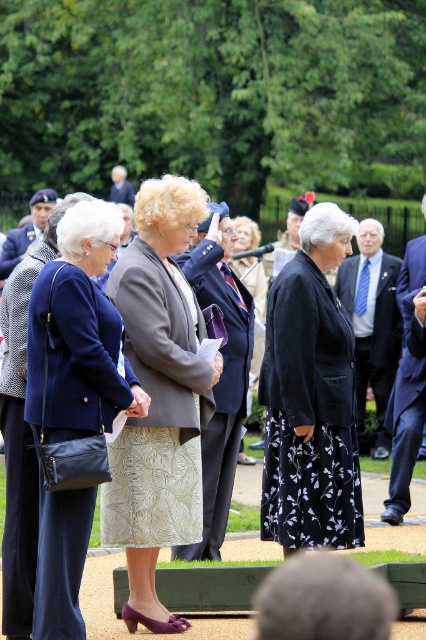
Question: Does purple fabric skirt at center come behind navy blue fabric coat at center?

Choices:
 (A) yes
 (B) no

Answer: (A)

Question: Does black floral skirt at center lie behind navy blue fabric coat at center?

Choices:
 (A) no
 (B) yes

Answer: (B)

Question: Which point is closer to the camera taking this photo?

Choices:
 (A) (14, 328)
 (B) (72, 257)
 (C) (317, 308)
 (D) (241, 451)

Answer: (B)

Question: Which point appears farthest from the camera in this image?

Choices:
 (A) (115, 310)
 (B) (101, 536)

Answer: (B)

Question: Which object appears farthest from the camera in this image?

Choices:
 (A) purple fabric skirt at center
 (B) matte black jacket at center
 (C) matte gray blazer at center
 (D) black floral skirt at center

Answer: (C)

Question: Where is purple fabric skirt at center located in relation to black floral skirt at center in the image?

Choices:
 (A) below
 (B) above

Answer: (A)